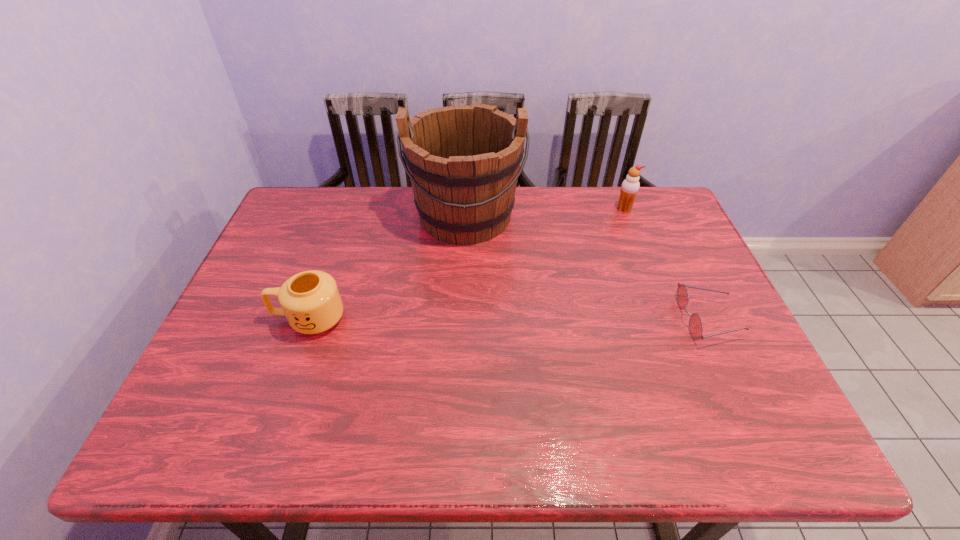
At what (x,y) coordinates should I click in order to perform the action: click on vacant space that satisfies the following two spatial constraints: 1. on the front side of the shortest object; 2. on the front-facing side of the wine bucket. Please return your answer as a coordinate pair (x, y). Image resolution: width=960 pixels, height=540 pixels. Looking at the image, I should click on (462, 320).